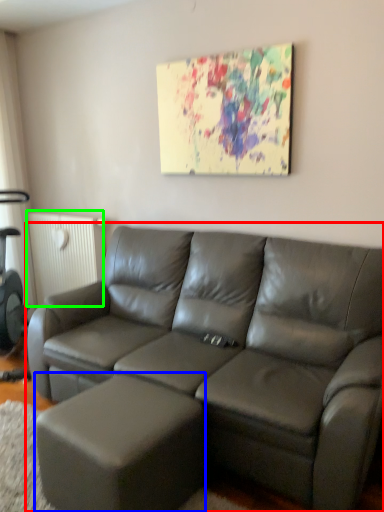
Question: Considering the real-world distances, which object is closest to studio couch (highlighted by a red box)? bar stool (highlighted by a blue box) or radiator (highlighted by a green box).

Choices:
 (A) bar stool
 (B) radiator

Answer: (A)